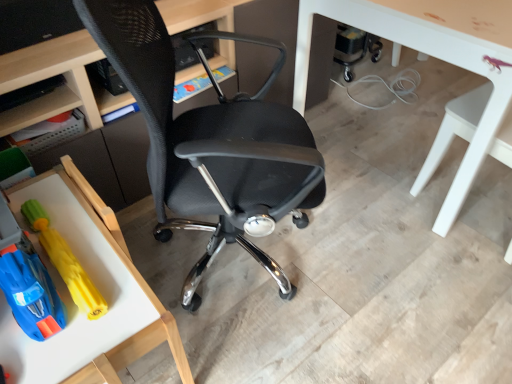
Question: Does wooden tray at lower left, placed as the 2th table when sorted from right to left, have a greater width compared to yellow rubber toy at lower left, marked as the second toy in a left-to-right arrangement?

Choices:
 (A) no
 (B) yes

Answer: (B)

Question: Is wooden tray at lower left, which is the first table in bottom-to-top order, further to the viewer compared to yellow rubber toy at lower left, marked as the second toy in a left-to-right arrangement?

Choices:
 (A) no
 (B) yes

Answer: (A)

Question: From the image's perspective, is wooden tray at lower left, arranged as the first table when viewed from the left, located above yellow rubber toy at lower left, the 1th toy from the right?

Choices:
 (A) no
 (B) yes

Answer: (A)

Question: Is wooden tray at lower left, which is the first table in bottom-to-top order, not near yellow rubber toy at lower left, the 1th toy from the right?

Choices:
 (A) yes
 (B) no

Answer: (B)

Question: Is wooden tray at lower left, which is the first table in bottom-to-top order, facing away from yellow rubber toy at lower left, the 1th toy from the right?

Choices:
 (A) no
 (B) yes

Answer: (A)

Question: From the image's perspective, relative to matte black shelf at upper left, is wooden tray at lower left, the 2th table when ordered from top to bottom, above or below?

Choices:
 (A) below
 (B) above

Answer: (A)

Question: Is wooden tray at lower left, which is the first table in bottom-to-top order, spatially inside matte black shelf at upper left, or outside of it?

Choices:
 (A) outside
 (B) inside

Answer: (A)

Question: Considering the positions of wooden tray at lower left, the 2th table when ordered from top to bottom, and matte black shelf at upper left in the image, is wooden tray at lower left, the 2th table when ordered from top to bottom, wider or thinner than matte black shelf at upper left?

Choices:
 (A) thin
 (B) wide

Answer: (B)

Question: Considering the positions of wooden tray at lower left, placed as the 2th table when sorted from right to left, and matte black shelf at upper left in the image, is wooden tray at lower left, placed as the 2th table when sorted from right to left, taller or shorter than matte black shelf at upper left?

Choices:
 (A) short
 (B) tall

Answer: (B)

Question: From the image's perspective, is black mesh chair at center, which is the second chair from right to left, located above or below white glossy table at right, which ranks as the first chair in right-to-left order?

Choices:
 (A) below
 (B) above

Answer: (A)

Question: From a real-world perspective, is black mesh chair at center, which is the second chair from right to left, above or below white glossy table at right, the second chair in the left-to-right sequence?

Choices:
 (A) above
 (B) below

Answer: (A)

Question: Is black mesh chair at center, which is the second chair from right to left, to the left or to the right of white glossy table at right, which ranks as the first chair in right-to-left order, in the image?

Choices:
 (A) left
 (B) right

Answer: (A)

Question: Relative to white glossy table at right, which ranks as the first chair in right-to-left order, is black mesh chair at center, which is the second chair from right to left, in front or behind?

Choices:
 (A) front
 (B) behind

Answer: (A)

Question: From the image's perspective, is rubberized yellow toy at lower left, the first toy positioned from the left, above or below matte black shelf at upper left?

Choices:
 (A) below
 (B) above

Answer: (A)

Question: In terms of size, does rubberized yellow toy at lower left, the first toy positioned from the left, appear bigger or smaller than matte black shelf at upper left?

Choices:
 (A) big
 (B) small

Answer: (A)